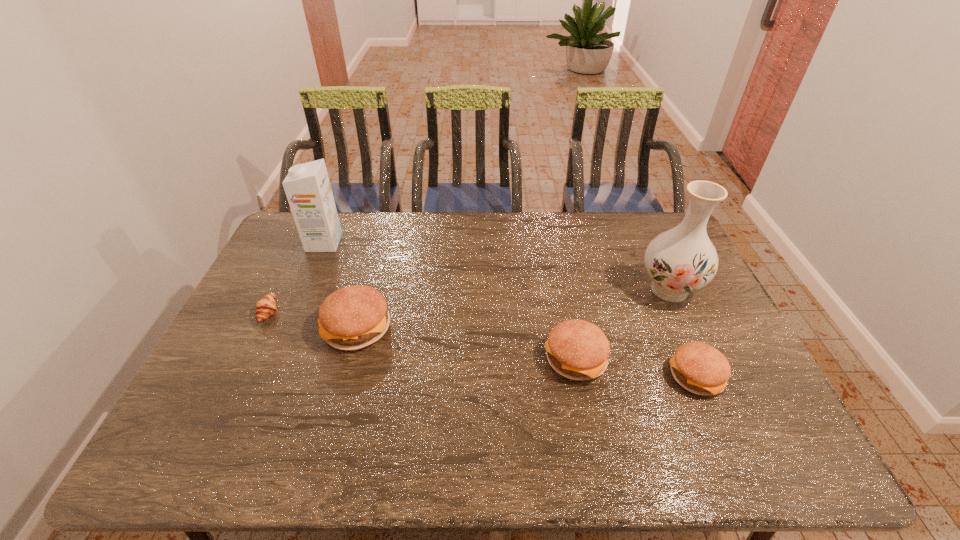
The image size is (960, 540). I want to click on free space for an extra hamburger to achieve even spacing, so tap(463, 342).